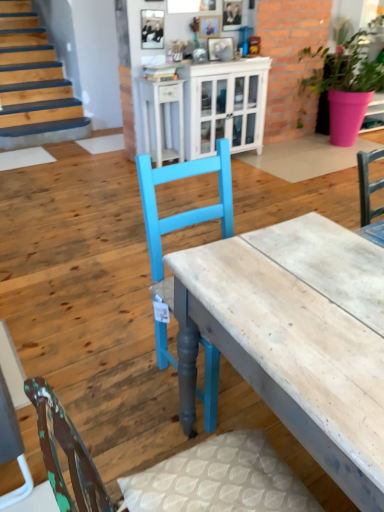
Question: Does white glossy cabinet at upper center come behind pink matte pot at upper right?

Choices:
 (A) no
 (B) yes

Answer: (B)

Question: Considering the relative sizes of white glossy cabinet at upper center and pink matte pot at upper right in the image provided, is white glossy cabinet at upper center smaller than pink matte pot at upper right?

Choices:
 (A) yes
 (B) no

Answer: (A)

Question: From the image's perspective, is white glossy cabinet at upper center on pink matte pot at upper right?

Choices:
 (A) no
 (B) yes

Answer: (A)

Question: From a real-world perspective, is white glossy cabinet at upper center beneath pink matte pot at upper right?

Choices:
 (A) no
 (B) yes

Answer: (B)

Question: Is white glossy cabinet at upper center positioned with its back to pink matte pot at upper right?

Choices:
 (A) no
 (B) yes

Answer: (A)

Question: Is white glossy cabinet at upper center not within pink matte pot at upper right?

Choices:
 (A) yes
 (B) no

Answer: (A)

Question: Does white glossy cabinet at upper center have a greater height compared to white glossy cabinet at upper center?

Choices:
 (A) no
 (B) yes

Answer: (B)

Question: From the image's perspective, is white glossy cabinet at upper center below white glossy cabinet at upper center?

Choices:
 (A) yes
 (B) no

Answer: (B)

Question: From the image's perspective, is white glossy cabinet at upper center on white glossy cabinet at upper center?

Choices:
 (A) no
 (B) yes

Answer: (B)

Question: From a real-world perspective, is white glossy cabinet at upper center physically above white glossy cabinet at upper center?

Choices:
 (A) yes
 (B) no

Answer: (A)

Question: Would you say white glossy cabinet at upper center contains white glossy cabinet at upper center?

Choices:
 (A) yes
 (B) no

Answer: (B)

Question: Is white glossy cabinet at upper center closer to the viewer compared to white glossy cabinet at upper center?

Choices:
 (A) yes
 (B) no

Answer: (B)

Question: Does white glossy cabinet at upper center have a lesser width compared to white glossy cabinet at upper center?

Choices:
 (A) no
 (B) yes

Answer: (B)